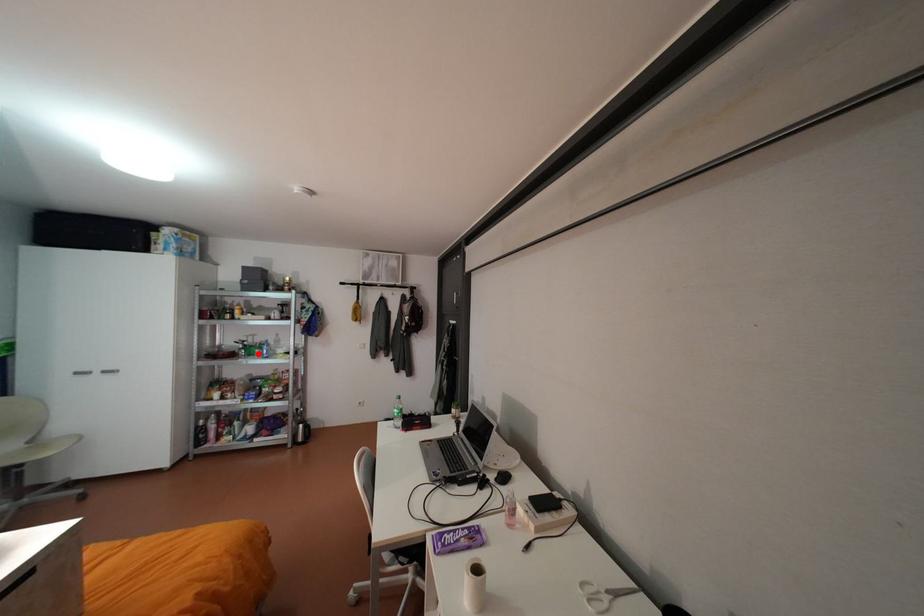
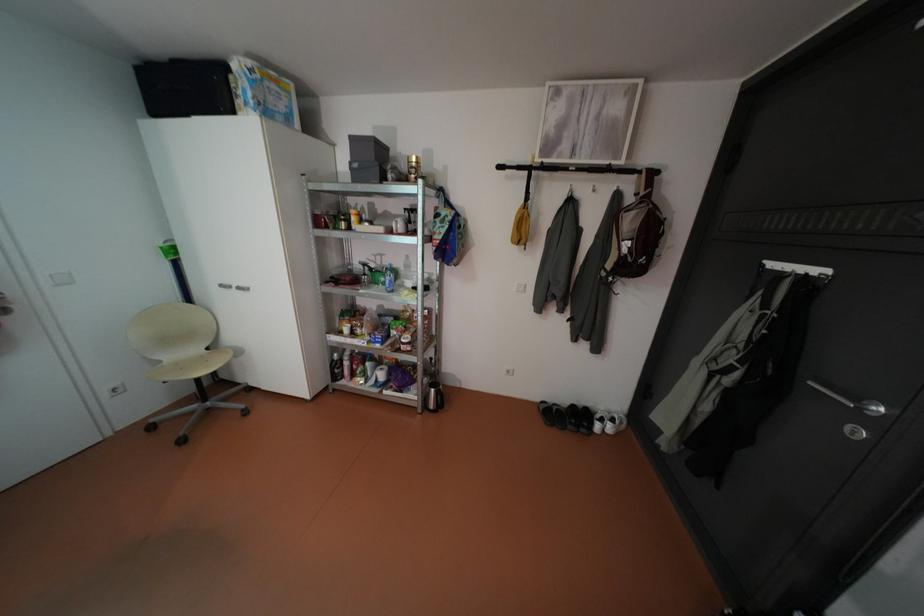
Question: I am providing you with two images of the same scene from different viewpoints. Image1 has a red point marked. In image2, the corresponding 3D location appears at what relative position? Reply with the corresponding letter.

Choices:
 (A) Closer
 (B) Farther

Answer: (A)